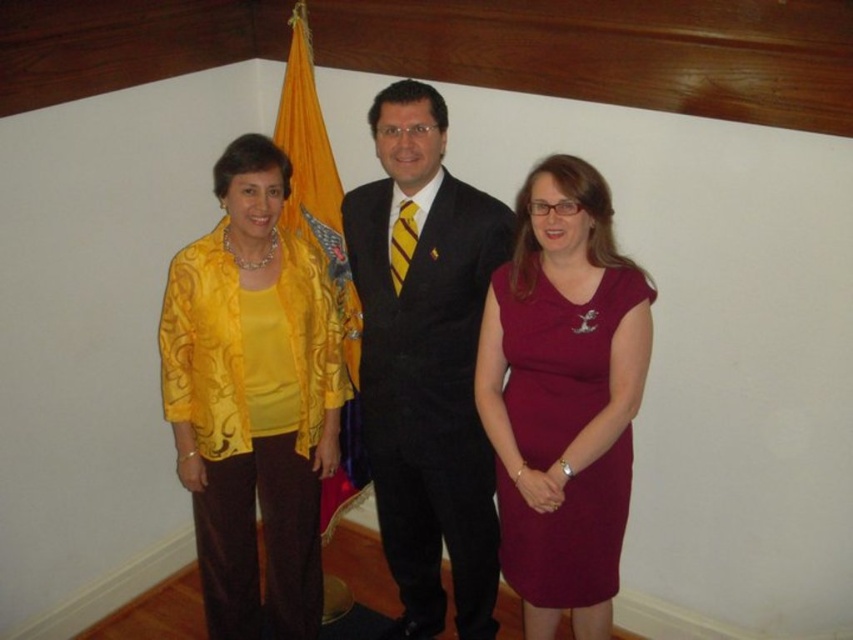
Does matte black suit at center appear on the left side of yellow satin flag at center?

In fact, matte black suit at center is to the right of yellow satin flag at center.

Is matte black suit at center positioned behind yellow satin flag at center?

No, matte black suit at center is closer to the viewer.

Locate an element on the screen. matte black suit at center is located at coordinates pos(425,362).

You are a GUI agent. You are given a task and a screenshot of the screen. Output one action in this format:
    pyautogui.click(x=<x>, y=<y>)
    Task: Click on the matte black suit at center
    Image resolution: width=853 pixels, height=640 pixels.
    Given the screenshot: What is the action you would take?
    pyautogui.click(x=425, y=362)

Is burgundy satin dress at center positioned before yellow satin flag at center?

Yes, it is.

Between point (567, 380) and point (302, 214), which one is positioned behind?

Positioned behind is point (302, 214).

Identify the location of burgundy satin dress at center. (560, 355).

In the scene shown: Between matte yellow blouse at center and burgundy satin dress at center, which one has more height?

matte yellow blouse at center is taller.

Who is lower down, matte yellow blouse at center or burgundy satin dress at center?

burgundy satin dress at center is below.

Who is more distant from viewer, (x=248, y=376) or (x=534, y=387)?

Positioned behind is point (x=248, y=376).

Image resolution: width=853 pixels, height=640 pixels. I want to click on matte yellow blouse at center, so click(253, 397).